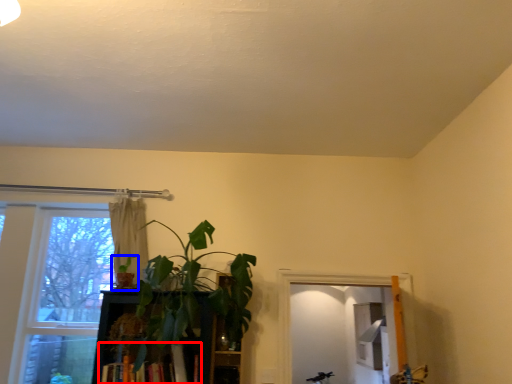
Question: Which point is further to the camera, book (highlighted by a red box) or houseplant (highlighted by a blue box)?

Choices:
 (A) book
 (B) houseplant

Answer: (B)